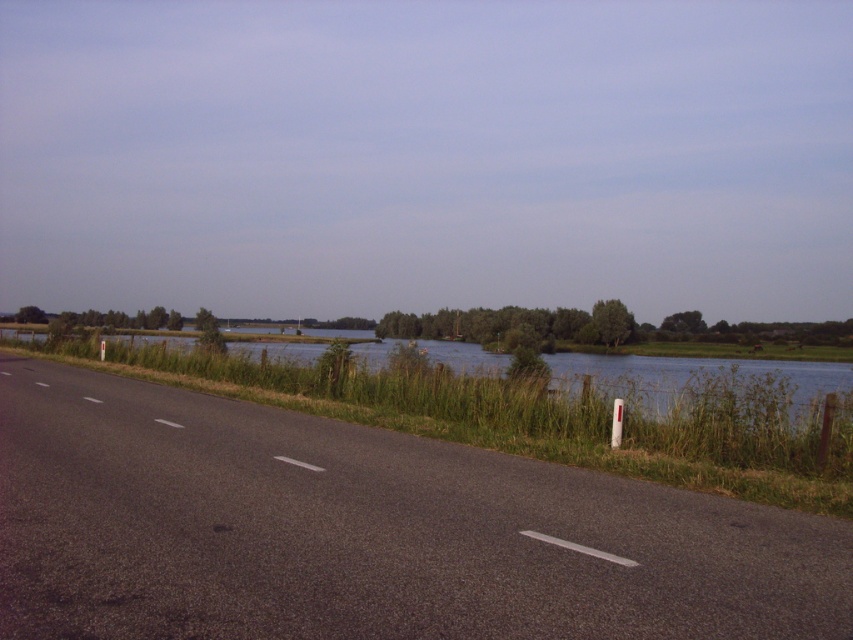
Question: Does black asphalt highway at center come behind green grassy river at center?

Choices:
 (A) no
 (B) yes

Answer: (A)

Question: Is black asphalt highway at center bigger than green grassy river at center?

Choices:
 (A) no
 (B) yes

Answer: (A)

Question: Is the position of black asphalt highway at center more distant than that of green grassy river at center?

Choices:
 (A) yes
 (B) no

Answer: (B)

Question: Which point appears closest to the camera in this image?

Choices:
 (A) (515, 476)
 (B) (743, 422)

Answer: (A)